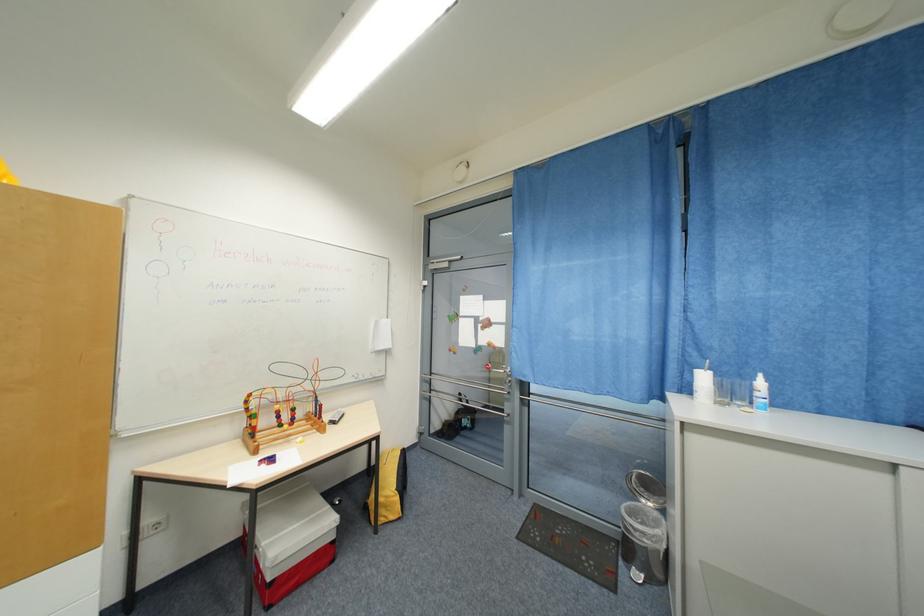
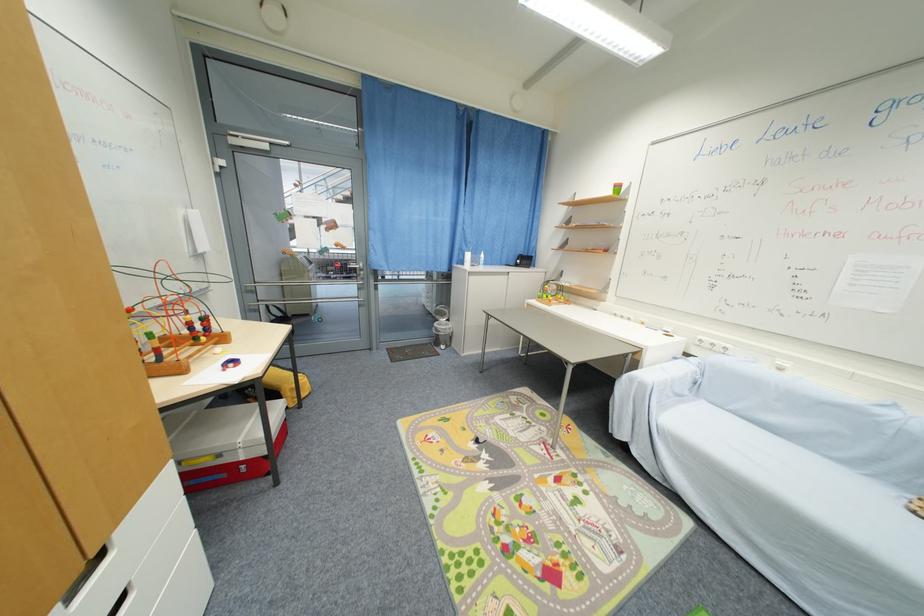
The point at (628, 511) is marked in the first image. Where is the corresponding point in the second image?

(441, 326)